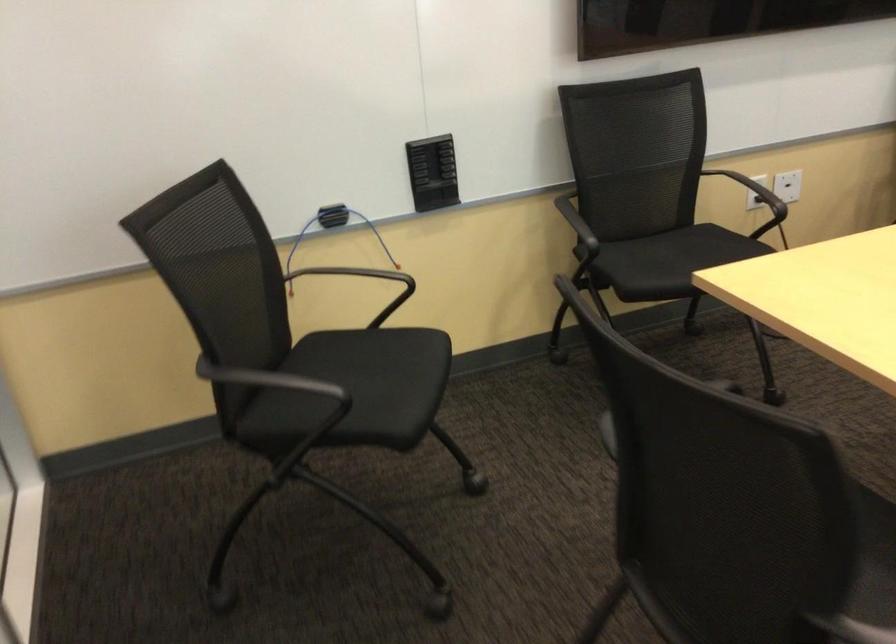
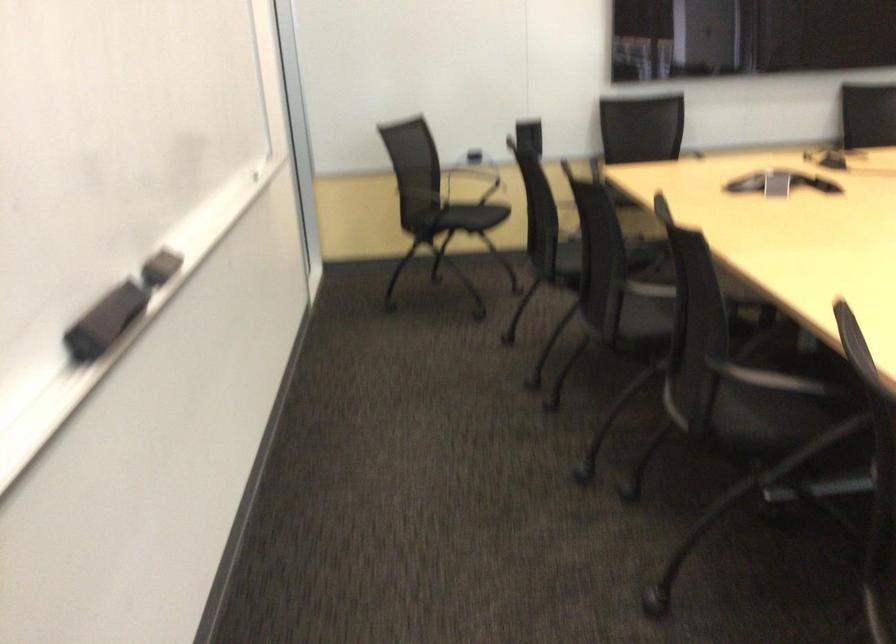
Find the pixel in the second image that matches point (302, 404) in the first image.

(448, 216)